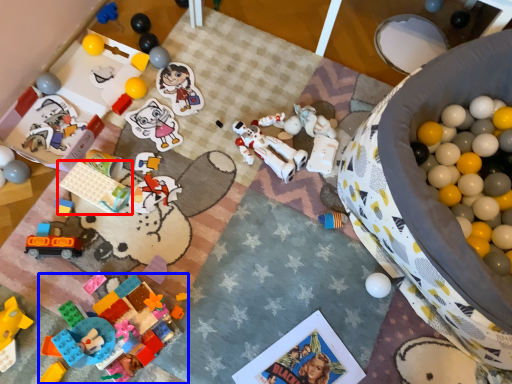
Question: Which object is closer to the camera taking this photo, toy (highlighted by a red box) or toy (highlighted by a blue box)?

Choices:
 (A) toy
 (B) toy

Answer: (B)